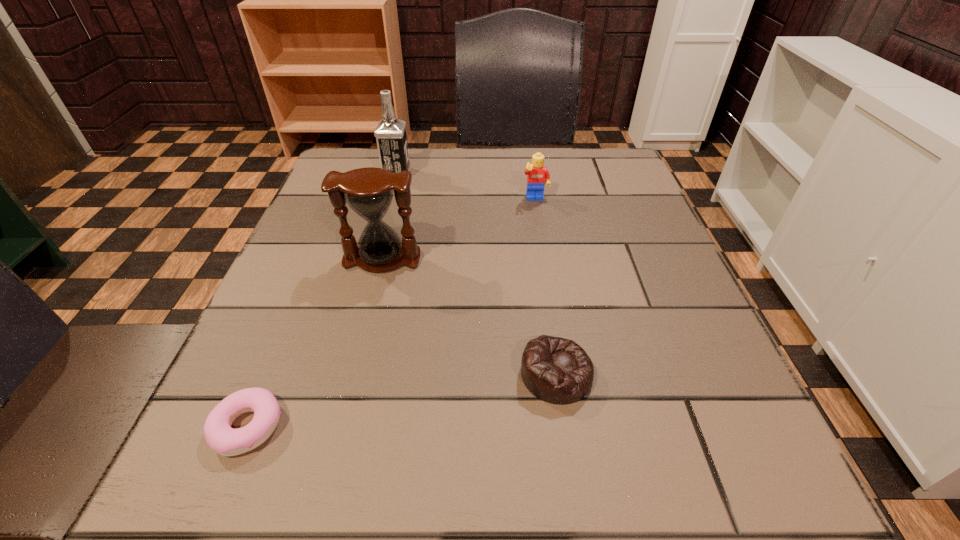
Where is `blank area at the far edge`? This screenshot has height=540, width=960. blank area at the far edge is located at coordinates (450, 148).

This screenshot has height=540, width=960. What are the coordinates of `vacant position at the near edge of the desktop` in the screenshot? It's located at (612, 491).

In the image, there is a desktop. What are the coordinates of `vacant space at the left edge` in the screenshot? It's located at (311, 239).

Where is `vacant area at the right edge`? vacant area at the right edge is located at coordinates (654, 227).

In order to click on vacant point at the far left corner in this screenshot , I will do `click(349, 167)`.

Locate an element on the screen. The height and width of the screenshot is (540, 960). free space at the near left corner is located at coordinates [283, 479].

In the image, there is a desktop. In order to click on free space at the far right corner in this screenshot , I will do `click(563, 162)`.

In the image, there is a desktop. Identify the location of vacant space at the near right corner. pyautogui.click(x=745, y=465).

At what (x,y) coordinates should I click in order to perform the action: click on empty location between the Lego and the second shortest object. Please return your answer as a coordinate pair (x, y). Looking at the image, I should click on (546, 287).

Where is `blank region between the hourglass and the fourth nearest object`? Image resolution: width=960 pixels, height=540 pixels. blank region between the hourglass and the fourth nearest object is located at coordinates (459, 230).